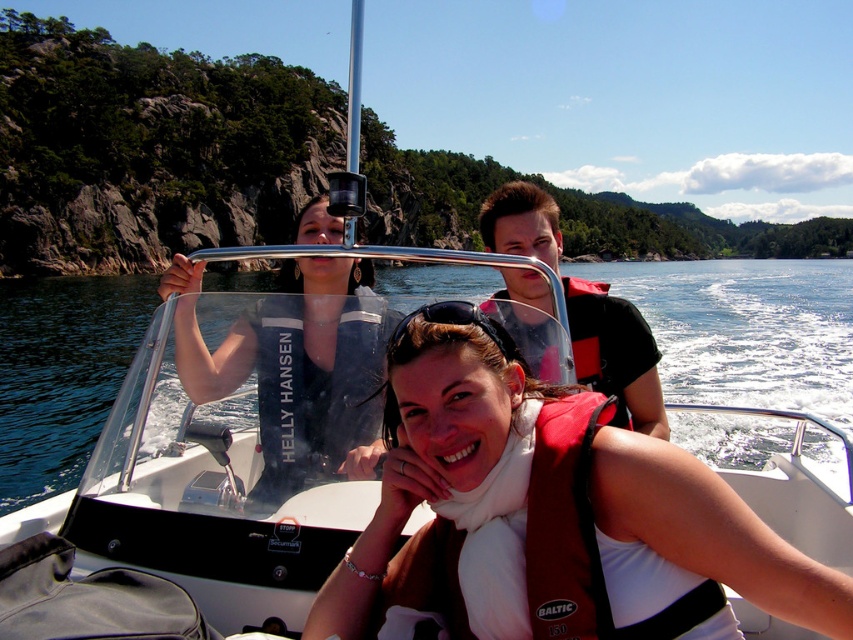
Question: Is brown fabric life vest at center bigger than clear blue water at center?

Choices:
 (A) no
 (B) yes

Answer: (A)

Question: Does brown fabric life vest at center appear over black fabric life vest at center?

Choices:
 (A) no
 (B) yes

Answer: (A)

Question: Estimate the real-world distances between objects in this image. Which object is closer to the black fabric life vest at center?

Choices:
 (A) black rubber goggles at center
 (B) clear blue water at center

Answer: (A)

Question: Is brown fabric life vest at center to the right of matte black jacket at upper center from the viewer's perspective?

Choices:
 (A) yes
 (B) no

Answer: (A)

Question: Which object is positioned closest to the black rubber goggles at center?

Choices:
 (A) clear blue water at center
 (B) brown fabric life vest at center
 (C) matte black jacket at upper center
 (D) black fabric life vest at center

Answer: (B)

Question: Among these points, which one is farthest from the camera?

Choices:
 (A) (450, 314)
 (B) (723, 285)

Answer: (B)